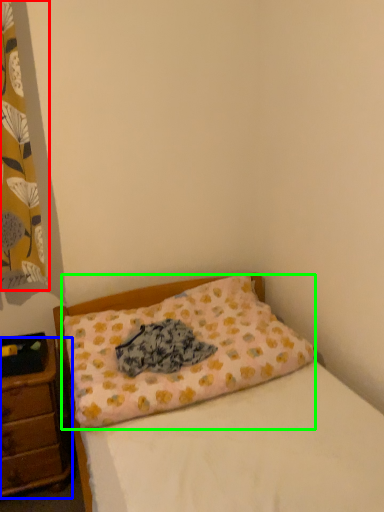
Question: Considering the real-world distances, which object is farthest from curtain (highlighted by a red box)? nightstand (highlighted by a blue box) or pillow (highlighted by a green box)?

Choices:
 (A) nightstand
 (B) pillow

Answer: (A)